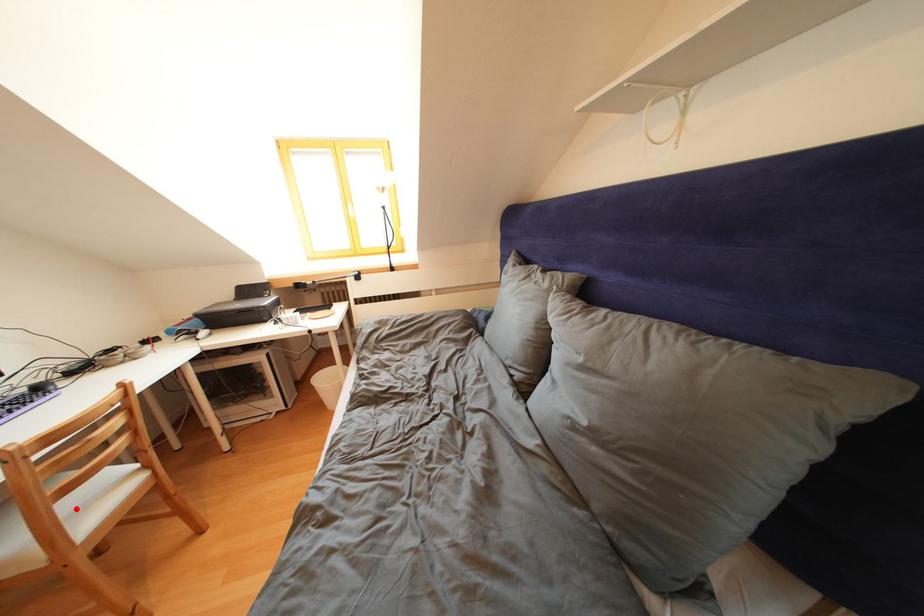
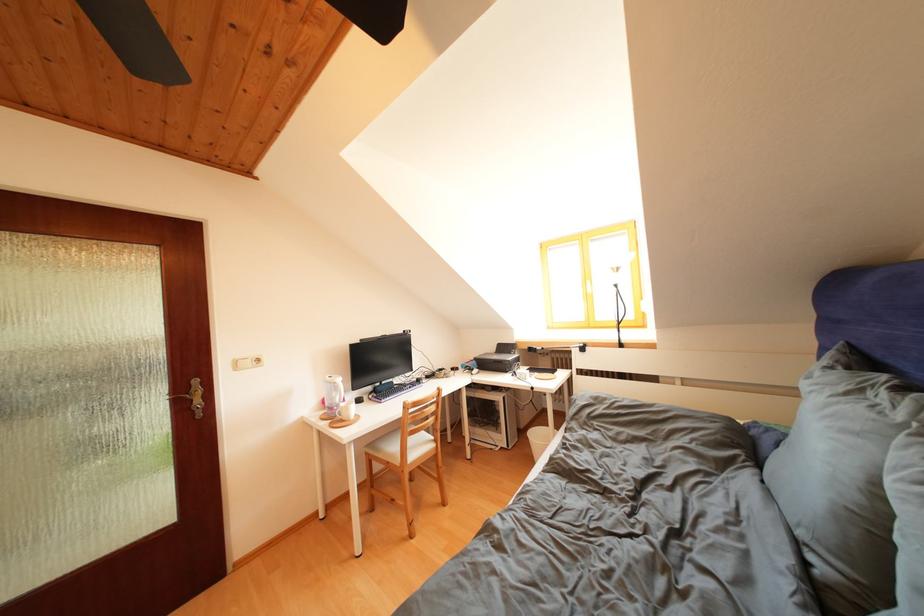
Locate, in the second image, the point that corresponds to the highlighted location in the first image.

(419, 446)